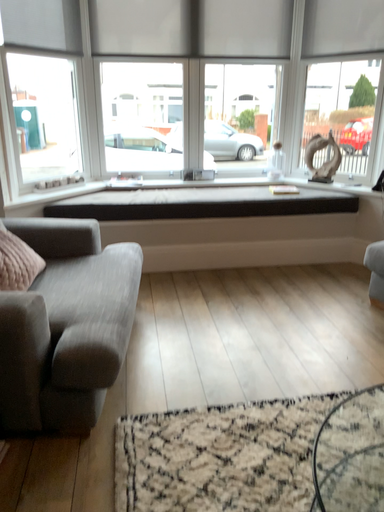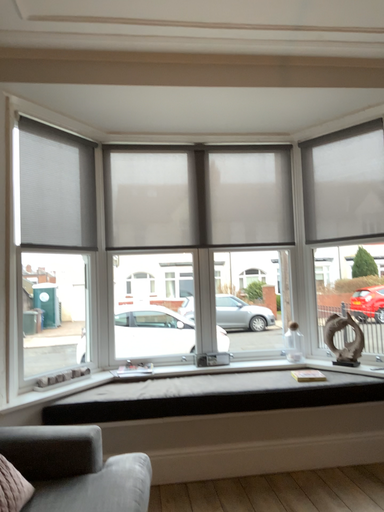
Question: Which way did the camera rotate in the video?

Choices:
 (A) rotated upward
 (B) rotated downward

Answer: (A)